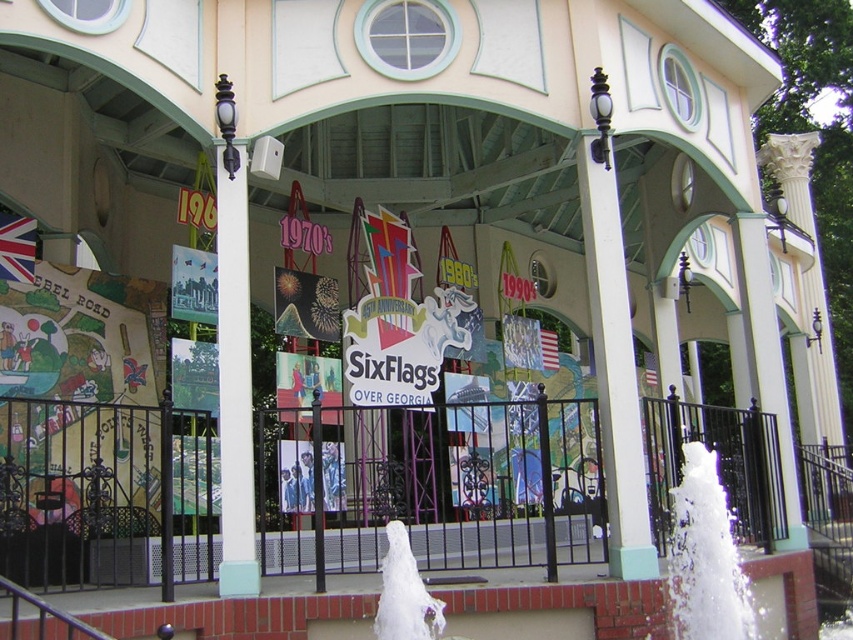
You are standing at the entrance of Six Flags Over Georgia and see the white matte fountain at center and the white frothy water at lower center. Which object is located to the right of the other?

The white matte fountain at center is positioned on the right side of white frothy water at lower center.

You are standing at the entrance of Six Flags Over Georgia and want to take a photo of the white matte fountain at center and the white frothy water at lower center. Which object should you focus on first if you want to capture both in a single shot without moving your camera?

You should focus on the white frothy water at lower center first because the white matte fountain at center is located below it, ensuring both will be in frame when centered on the upper object.